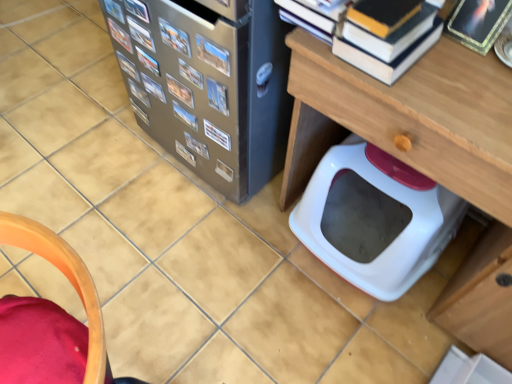
Measure the distance between metallic silver book at center, positioned as the twelfth book in front-to-back order, and camera.

The distance of metallic silver book at center, positioned as the twelfth book in front-to-back order, from camera is 4.00 feet.

Describe the element at coordinates (114, 10) in the screenshot. The width and height of the screenshot is (512, 384). I see `metallic silver book at upper left, the 8th book when ordered from front to back` at that location.

Measure the distance between metallic silver book at upper left, which is counted as the 9th book, starting from the back, and camera.

metallic silver book at upper left, which is counted as the 9th book, starting from the back, and camera are 3.58 feet apart from each other.

Describe the element at coordinates (139, 112) in the screenshot. I see `metallic silver book at center-left, arranged as the first book when viewed from the back` at that location.

In order to click on metallic silver book at center-left, arranged as the first book when viewed from the back in this screenshot , I will do `click(139, 112)`.

The height and width of the screenshot is (384, 512). In order to click on metallic silver book at upper left, which appears as the 5th book when viewed from the back in this screenshot , I will do `click(120, 35)`.

Is metallic silver book at upper left, which appears as the 5th book when viewed from the back, shorter than metallic silver book at center, the 9th book viewed from the front?

In fact, metallic silver book at upper left, which appears as the 5th book when viewed from the back, may be taller than metallic silver book at center, the 9th book viewed from the front.

Is metallic silver book at upper left, the eleventh book viewed from the front, facing towards metallic silver book at center, acting as the seventh book starting from the back?

No, metallic silver book at upper left, the eleventh book viewed from the front, is not facing towards metallic silver book at center, acting as the seventh book starting from the back.

Looking at this image, is metallic silver book at center, the 9th book viewed from the front, surrounded by metallic silver book at upper left, the eleventh book viewed from the front?

No, metallic silver book at center, the 9th book viewed from the front, is not inside metallic silver book at upper left, the eleventh book viewed from the front.

Locate an element on the screen. The height and width of the screenshot is (384, 512). book that is the 10th object located above the metallic silver book at center, the 9th book viewed from the front (from the image's perspective) is located at coordinates (120, 35).

This screenshot has width=512, height=384. Identify the location of the 3rd book located beneath the metallic silver book at upper center, marked as the tenth book in a back-to-front arrangement (from a real-world perspective). (148, 61).

Based on their sizes in the image, would you say metallic silver book at center, which ranks as the tenth book in front-to-back order, is bigger or smaller than metallic silver book at upper center, marked as the tenth book in a back-to-front arrangement?

metallic silver book at center, which ranks as the tenth book in front-to-back order, is bigger than metallic silver book at upper center, marked as the tenth book in a back-to-front arrangement.

Is metallic silver book at center, which ranks as the tenth book in front-to-back order, at the right side of metallic silver book at upper center, the 6th book from the front?

Incorrect, metallic silver book at center, which ranks as the tenth book in front-to-back order, is not on the right side of metallic silver book at upper center, the 6th book from the front.

Is metallic silver book at center, placed as the 6th book when sorted from back to front, completely or partially outside of metallic silver book at upper center, marked as the tenth book in a back-to-front arrangement?

Yes, metallic silver book at center, placed as the 6th book when sorted from back to front, is not within metallic silver book at upper center, marked as the tenth book in a back-to-front arrangement.

From the picture: Which is more to the left, metallic silver book at center, the 9th book viewed from the front, or metallic silver book at upper center, the 6th book from the front?

Positioned to the left is metallic silver book at center, the 9th book viewed from the front.

Between metallic silver book at center, the 9th book viewed from the front, and metallic silver book at upper center, the 6th book from the front, which one has smaller size?

metallic silver book at upper center, the 6th book from the front.

From a real-world perspective, does metallic silver book at center, acting as the seventh book starting from the back, sit lower than metallic silver book at upper center, the 6th book from the front?

Indeed, from a real-world perspective, metallic silver book at center, acting as the seventh book starting from the back, is positioned beneath metallic silver book at upper center, the 6th book from the front.

Looking at their sizes, would you say metallic silver book at center, the 9th book viewed from the front, is wider or thinner than metallic silver book at upper center, the 6th book from the front?

In the image, metallic silver book at center, the 9th book viewed from the front, appears to be more narrow than metallic silver book at upper center, the 6th book from the front.

How different are the orientations of matte paper paperback book at center and metallic silver book at center, the third book in the back-to-front sequence, in degrees?

They differ by 0.00561 degrees in their facing directions.

Considering the sizes of objects matte paper paperback book at center and metallic silver book at center, placed as the 13th book when sorted from front to back, in the image provided, who is wider, matte paper paperback book at center or metallic silver book at center, placed as the 13th book when sorted from front to back,?

With larger width is metallic silver book at center, placed as the 13th book when sorted from front to back.

Choose the correct answer: Is matte paper paperback book at center inside metallic silver book at center, the third book in the back-to-front sequence, or outside it?

matte paper paperback book at center lies outside metallic silver book at center, the third book in the back-to-front sequence.

Can you confirm if matte paper paperback book at center is shorter than metallic silver book at center, the third book in the back-to-front sequence?

Indeed, matte paper paperback book at center has a lesser height compared to metallic silver book at center, the third book in the back-to-front sequence.

Does wooden table at lower right turn towards metallic silver book at upper left, which is counted as the 9th book, starting from the back?

No.

Considering the sizes of objects wooden table at lower right and metallic silver book at upper left, which is counted as the 9th book, starting from the back, in the image provided, who is bigger, wooden table at lower right or metallic silver book at upper left, which is counted as the 9th book, starting from the back,?

wooden table at lower right.

How different are the orientations of wooden table at lower right and metallic silver book at upper left, which is counted as the 9th book, starting from the back, in degrees?

wooden table at lower right and metallic silver book at upper left, which is counted as the 9th book, starting from the back, are facing 0.0017 degrees away from each other.

Considering the positions of points (306, 111) and (143, 35), is point (306, 111) closer to camera compared to point (143, 35)?

That is True.

Is metallic silver book at upper left, which appears as the 5th book when viewed from the back, looking in the opposite direction of metallic silver book at center, the third book in the back-to-front sequence?

That's not correct — metallic silver book at upper left, which appears as the 5th book when viewed from the back, is not looking away from metallic silver book at center, the third book in the back-to-front sequence.

Is metallic silver book at upper left, the eleventh book viewed from the front, located outside metallic silver book at center, placed as the 13th book when sorted from front to back?

metallic silver book at upper left, the eleventh book viewed from the front, lies outside metallic silver book at center, placed as the 13th book when sorted from front to back,'s area.

From the image's perspective, is metallic silver book at upper left, which appears as the 5th book when viewed from the back, beneath metallic silver book at center, the third book in the back-to-front sequence?

No.

Is metallic silver book at upper left, which appears as the 5th book when viewed from the back, placed right next to metallic silver book at center, the third book in the back-to-front sequence?

metallic silver book at upper left, which appears as the 5th book when viewed from the back, is not next to metallic silver book at center, the third book in the back-to-front sequence, and they're not touching.

From the picture: From the image's perspective, is metallic photo album at upper center, which is the third book from front to back, beneath metallic silver book at center, the 9th book viewed from the front?

No, from the image's perspective, metallic photo album at upper center, which is the third book from front to back, is not beneath metallic silver book at center, the 9th book viewed from the front.

Would you say metallic photo album at upper center, which is the third book from front to back, is inside or outside metallic silver book at center, the 9th book viewed from the front?

The correct answer is: outside.

From the picture: From a real-world perspective, is metallic photo album at upper center, marked as the 13th book in a back-to-front arrangement, below metallic silver book at center, the 9th book viewed from the front?

No, from a real-world perspective, metallic photo album at upper center, marked as the 13th book in a back-to-front arrangement, is not below metallic silver book at center, the 9th book viewed from the front.

There is a metallic silver book at center, the 9th book viewed from the front. Where is `the 2nd book above it (from a real-world perspective)`? the 2nd book above it (from a real-world perspective) is located at coordinates (120, 35).

Where is `the 4th book in front when counting from the metallic silver book at center, which ranks as the tenth book in front-to-back order`? This screenshot has width=512, height=384. the 4th book in front when counting from the metallic silver book at center, which ranks as the tenth book in front-to-back order is located at coordinates (190, 74).

Considering their positions, is metallic silver book at center, acting as the seventh book starting from the back, positioned further to metallic silver book at center, placed as the 13th book when sorted from front to back, than metallic silver book at center, positioned as the twelfth book in front-to-back order?

The object further to metallic silver book at center, placed as the 13th book when sorted from front to back, is metallic silver book at center, acting as the seventh book starting from the back.

Considering their positions, is metallic silver book at center, the second book positioned from the front, positioned further to wooden table at lower right than metallic silver book at upper left, the eleventh book viewed from the front?

Among the two, metallic silver book at upper left, the eleventh book viewed from the front, is located further to wooden table at lower right.

Based on their spatial positions, is metallic silver book at center, placed as the 6th book when sorted from back to front, or matte paper paperback book at center further from metallic silver book at center, marked as the 4th book in a back-to-front arrangement?

metallic silver book at center, placed as the 6th book when sorted from back to front.

Based on their spatial positions, is metallic photo album at upper center, which is the third book from front to back, or metallic silver book at center, which is the 5th book from front to back, further from metallic silver book at upper center, the 6th book from the front?

metallic photo album at upper center, which is the third book from front to back.

Based on their spatial positions, is metallic silver book at upper left, acting as the eighth book starting from the back, or metallic silver book at upper left, which is the fourth book from front to back, closer to metallic silver book at center, which ranks as the tenth book in front-to-back order?

metallic silver book at upper left, acting as the eighth book starting from the back, is positioned closer to the anchor metallic silver book at center, which ranks as the tenth book in front-to-back order.

Based on their spatial positions, is metallic silver book at upper center, marked as the tenth book in a back-to-front arrangement, or matte paper paperback book at center closer to metallic silver book at center, acting as the seventh book starting from the back?

metallic silver book at upper center, marked as the tenth book in a back-to-front arrangement, is closer to metallic silver book at center, acting as the seventh book starting from the back.

Looking at the image, which one is located further to metallic silver book at upper center, marked as the tenth book in a back-to-front arrangement, metallic black file cabinet at center or metallic silver book at center, the third book in the back-to-front sequence?

metallic black file cabinet at center is positioned further to the anchor metallic silver book at upper center, marked as the tenth book in a back-to-front arrangement.

Estimate the real-world distances between objects in this image. Which object is closer to matte paper paperback book at center, metallic photo album at upper center, which is the third book from front to back, or metallic silver book at center, the eleventh book when ordered from back to front?

The object closer to matte paper paperback book at center is metallic silver book at center, the eleventh book when ordered from back to front.

Locate an element on the screen. The width and height of the screenshot is (512, 384). paperback book between metallic silver book at center, the eleventh book when ordered from back to front, and metallic silver book at center, marked as the 4th book in a back-to-front arrangement, in the front-back direction is located at coordinates (217, 135).

I want to click on paperback book between metallic silver book at upper left, acting as the eighth book starting from the back, and wooden table at lower right, in the horizontal direction, so click(x=217, y=135).

At what (x,y) coordinates should I click in order to perform the action: click on paperback book between metallic silver book at upper left, the eleventh book viewed from the front, and metallic silver book at center, which is the 5th book from front to back, in the horizontal direction. Please return your answer as a coordinate pair (x, y). This screenshot has width=512, height=384. Looking at the image, I should click on (217, 135).

Find the location of a particular element. Image resolution: width=512 pixels, height=384 pixels. file cabinet between metallic silver book at upper left, the 8th book when ordered from front to back, and hardcover book at upper right, the 1th book from the front, in the horizontal direction is located at coordinates (221, 83).